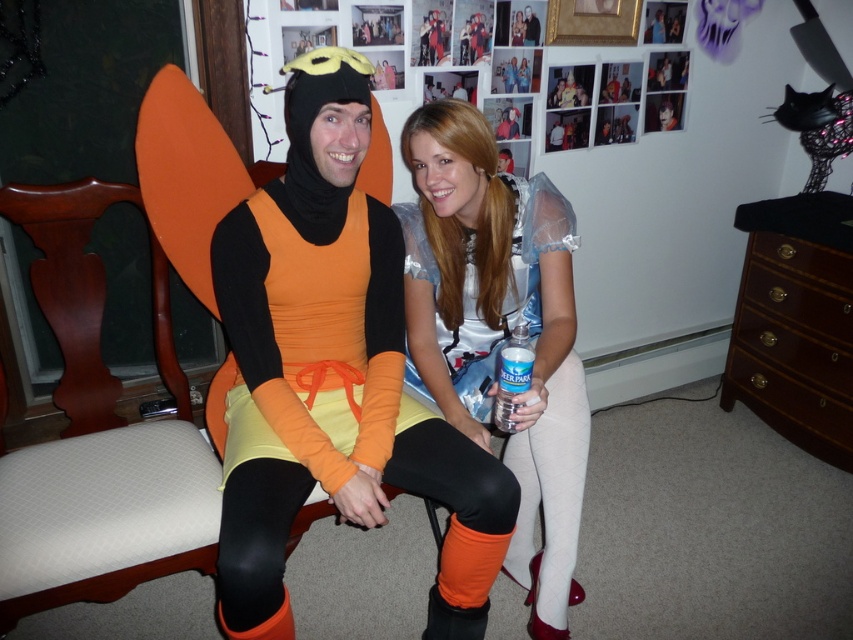
You are a photographer setting up a photo shoot in the described scene. You need to position a light source so that it illuminates both the matte silver dress at center and the matte black costume at center without casting shadows on the background wall. Given their height difference, which costume should be placed closer to the light source to achieve even lighting?

The matte silver dress at center is much taller than the matte black costume at center. To achieve even lighting, the shorter matte black costume at center should be placed closer to the light source so that both receive similar illumination levels.